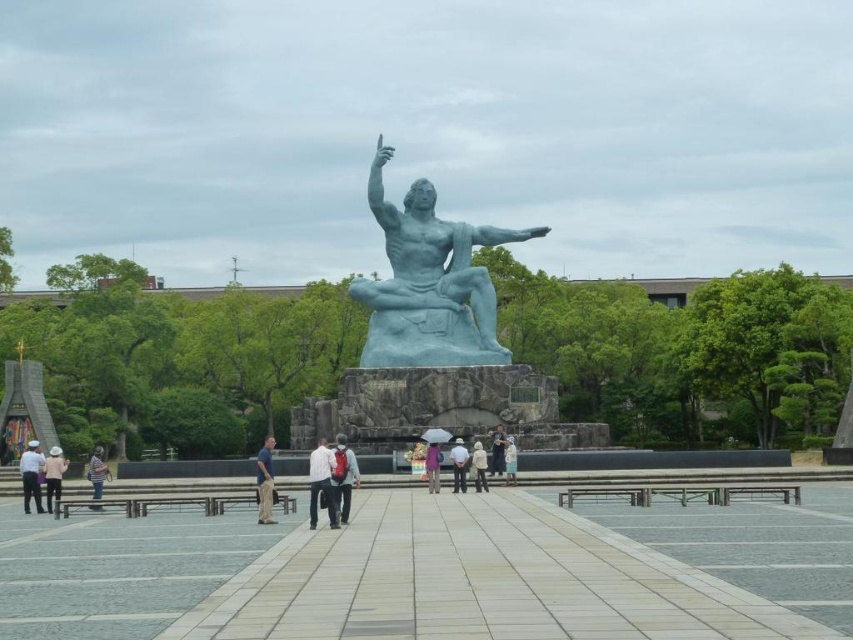
You are a photographer trying to capture both the white matte shirt at center and the matte blue statue at center in a single frame. Considering their sizes, which object should you focus on to ensure both are clearly visible in your photo?

The white matte shirt at center is larger in size than the matte blue statue at center, so focusing on the white matte shirt at center would ensure both are clearly visible as it takes up more space in the frame.

You are a photographer standing in the public square and want to capture both the white hat at lower left and the light brown leather jacket at center in a single frame. Based on their positions, can you tell me which object is closer to the bottom edge of the photo?

The white hat at lower left is below the light brown leather jacket at center, so the white hat at lower left is closer to the bottom edge of the photo.

You are standing in front of the statue and notice both the white matte hat at center and the light blue statue at center. Which object is nearer to you?

The white matte hat at center is closer to the viewer than the light blue statue at center.